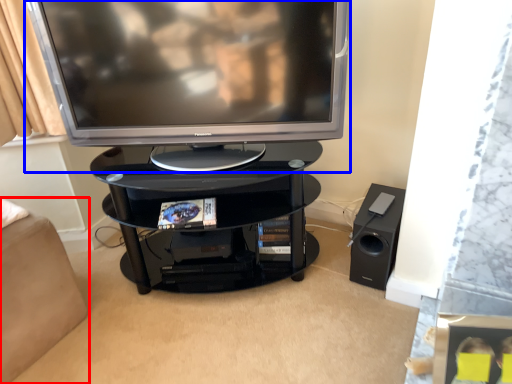
Question: Which of the following is the farthest to the observer, furniture (highlighted by a red box) or television (highlighted by a blue box)?

Choices:
 (A) furniture
 (B) television

Answer: (A)